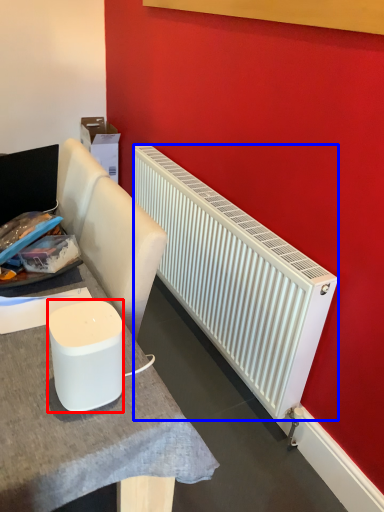
Question: Which of the following is the closest to the observer, appliance (highlighted by a red box) or radiator (highlighted by a blue box)?

Choices:
 (A) appliance
 (B) radiator

Answer: (A)